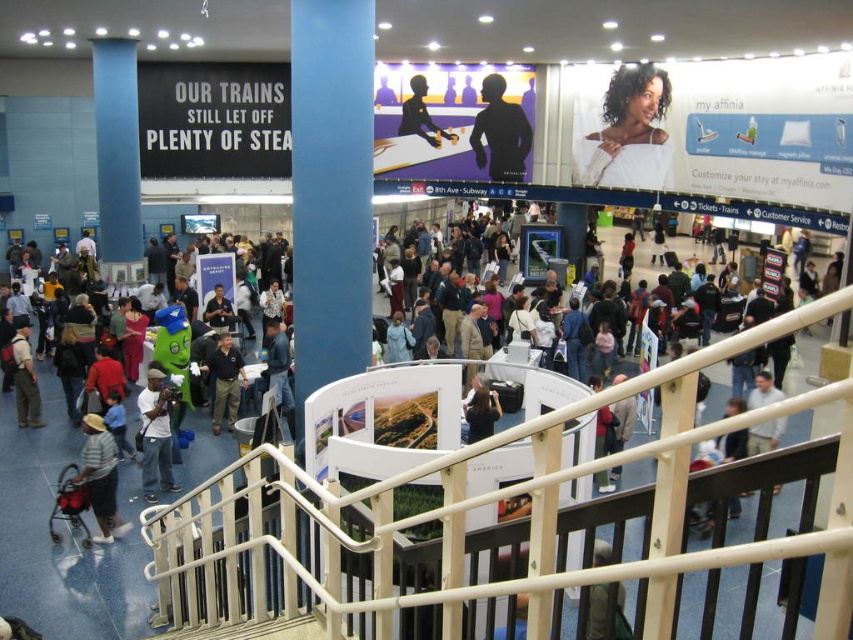
Which of these two, white fabric at upper center or striped cotton shirt at lower left, stands shorter?

Standing shorter between the two is white fabric at upper center.

Is white fabric at upper center closer to camera compared to striped cotton shirt at lower left?

No.

This screenshot has height=640, width=853. What do you see at coordinates (631, 131) in the screenshot? I see `white fabric at upper center` at bounding box center [631, 131].

The height and width of the screenshot is (640, 853). In order to click on white fabric at upper center in this screenshot , I will do `click(631, 131)`.

Is point (531, 145) positioned in front of point (421, 90)?

Yes.

Where is `black matte figure at upper center`? black matte figure at upper center is located at coordinates (500, 132).

Consider the image. Is the position of dark blue shirt at center more distant than that of silhouette figure at upper center?

No.

Between point (231, 365) and point (412, 97), which one is positioned in front?

Point (231, 365) is in front.

Does point (228, 394) lie behind point (422, 115)?

No.

I want to click on dark blue shirt at center, so click(x=224, y=381).